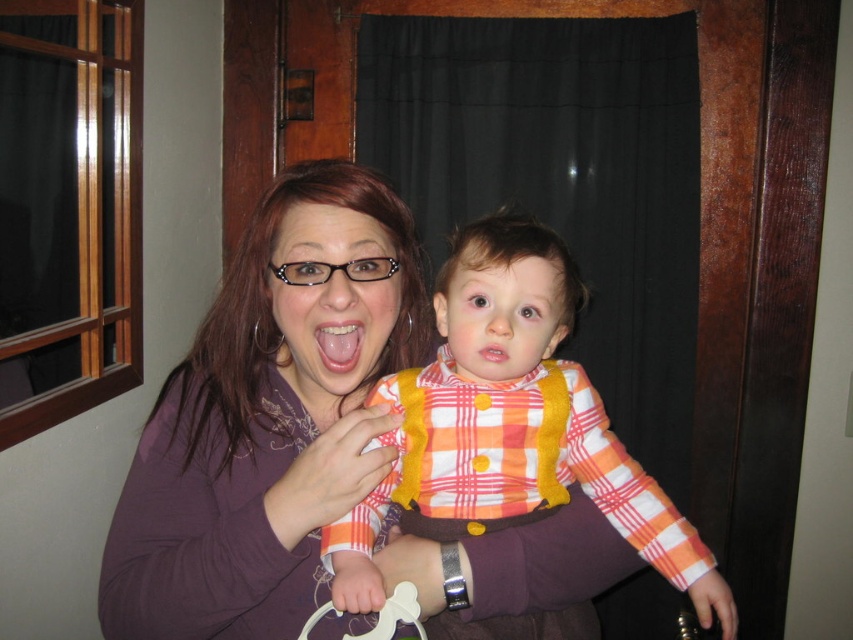
Is the position of matte purple shirt at center more distant than that of pink glossy tongue at center?

No.

Which is in front, point (358, 438) or point (334, 371)?

Point (358, 438) is more forward.

This screenshot has width=853, height=640. Identify the location of matte purple shirt at center. (265, 420).

Is plaid fabric shirt at center positioned behind pink glossy tongue at center?

No, plaid fabric shirt at center is closer to the viewer.

Which is behind, point (466, 408) or point (328, 355)?

The point (466, 408) is behind.

At what (x,y) coordinates should I click in order to perform the action: click on plaid fabric shirt at center. Please return your answer as a coordinate pair (x, y). Looking at the image, I should click on click(511, 426).

Does matte purple shirt at center appear under plaid fabric shirt at center?

No, matte purple shirt at center is not below plaid fabric shirt at center.

Who is taller, matte purple shirt at center or plaid fabric shirt at center?

matte purple shirt at center

Describe the element at coordinates (265, 420) in the screenshot. I see `matte purple shirt at center` at that location.

The image size is (853, 640). I want to click on matte purple shirt at center, so click(265, 420).